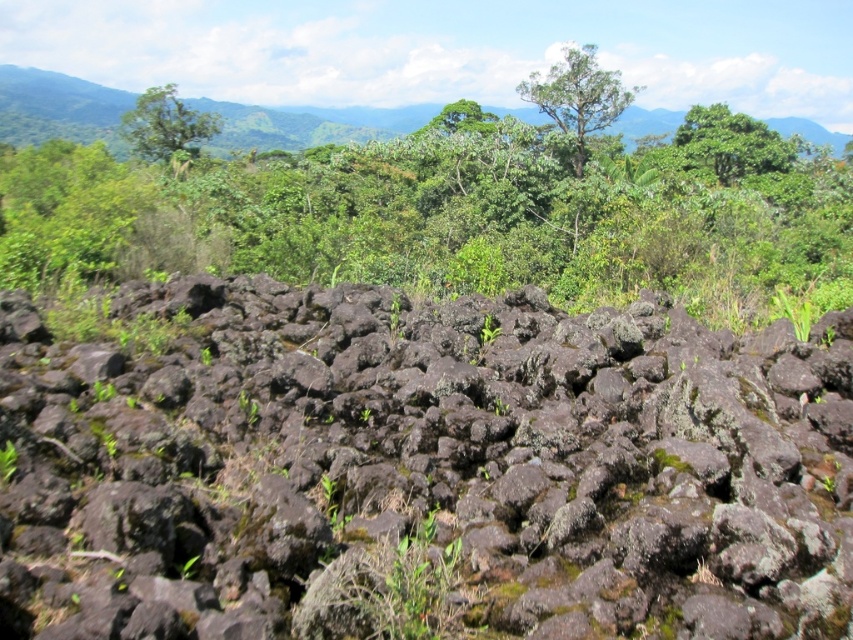
Question: Does dark gray rough rock at center appear under green leafy tree at upper center?

Choices:
 (A) no
 (B) yes

Answer: (B)

Question: Which of the following is the closest to the observer?

Choices:
 (A) green leafy tree at upper center
 (B) green leafy tree at upper right
 (C) dark gray rough rock at center
 (D) green leafy tree at upper left

Answer: (C)

Question: Among these points, which one is farthest from the camera?

Choices:
 (A) (822, 438)
 (B) (728, 120)
 (C) (577, 140)
 (D) (178, 148)

Answer: (B)

Question: Does dark gray rough rock at center appear on the right side of green leafy tree at upper left?

Choices:
 (A) yes
 (B) no

Answer: (A)

Question: Which object is closer to the camera taking this photo?

Choices:
 (A) green leafy tree at upper left
 (B) green leafy tree at upper center
 (C) dark gray rough rock at center

Answer: (C)

Question: Can you confirm if green leafy tree at upper center is positioned above green leafy tree at upper right?

Choices:
 (A) no
 (B) yes

Answer: (A)